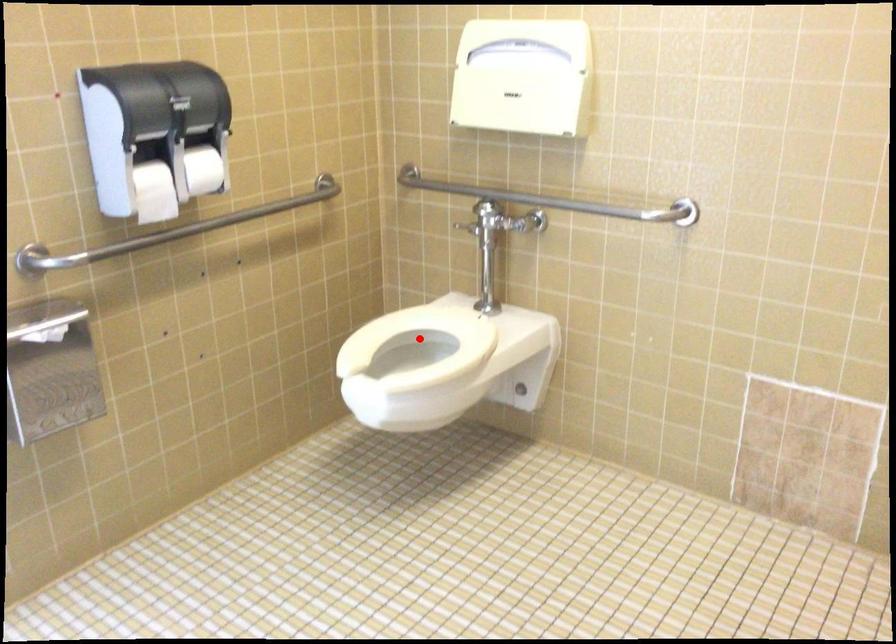
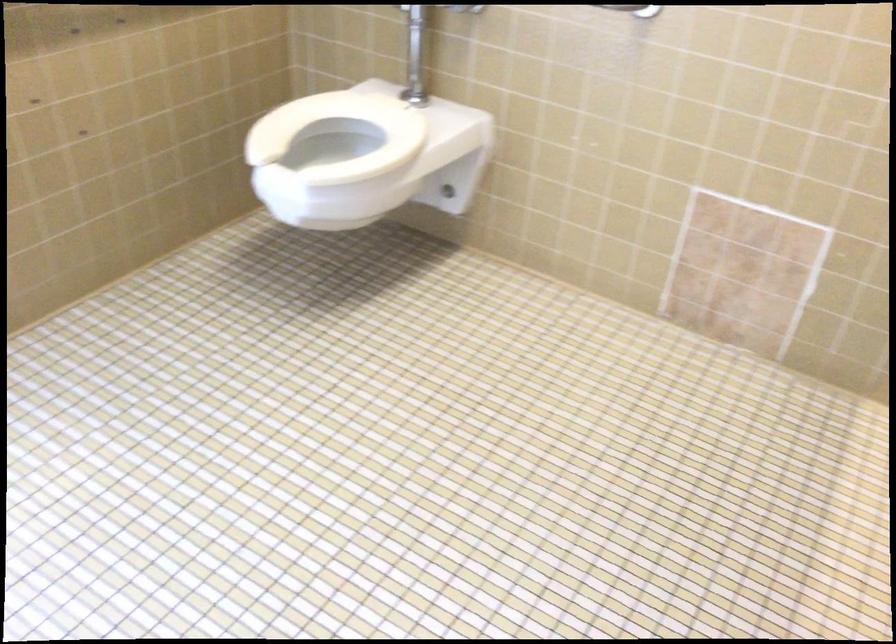
Locate, in the second image, the point that corresponds to the highlighted location in the first image.

(339, 134)